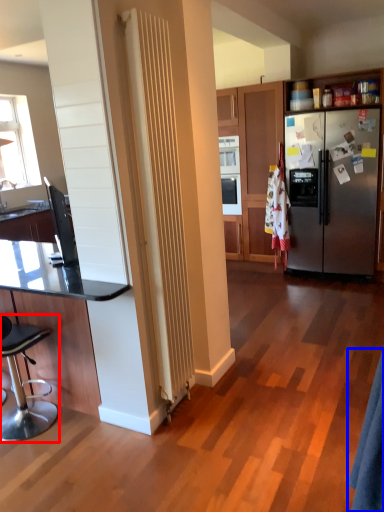
Question: Among these objects, which one is farthest to the camera, chair (highlighted by a red box) or robe (highlighted by a blue box)?

Choices:
 (A) chair
 (B) robe

Answer: (A)